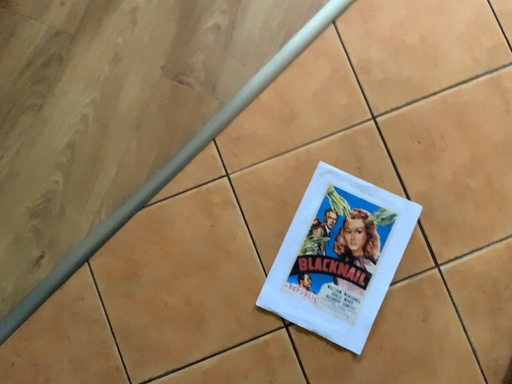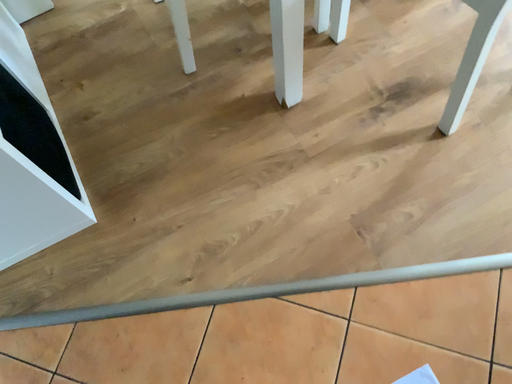
Question: Which way did the camera rotate in the video?

Choices:
 (A) rotated right
 (B) rotated left

Answer: (B)